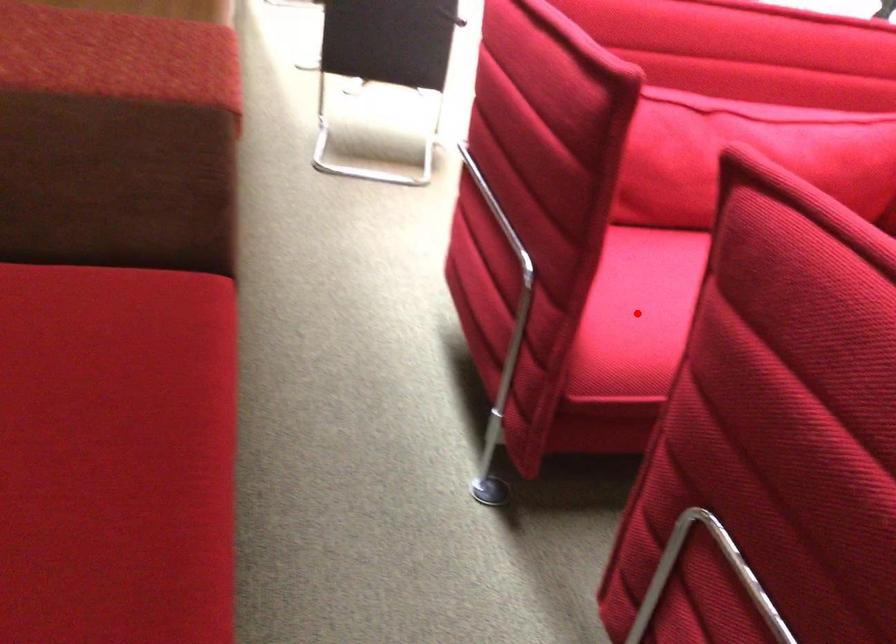
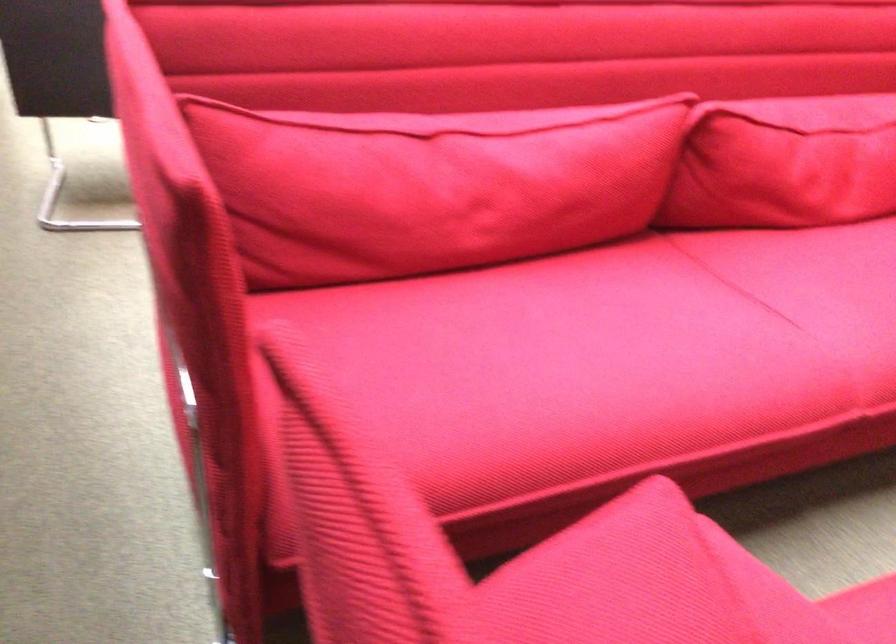
Question: I am providing you with two images of the same scene from different viewpoints. A red point is marked on the first image. Is the red point's position out of view in image 2?

Choices:
 (A) Yes
 (B) No

Answer: (A)